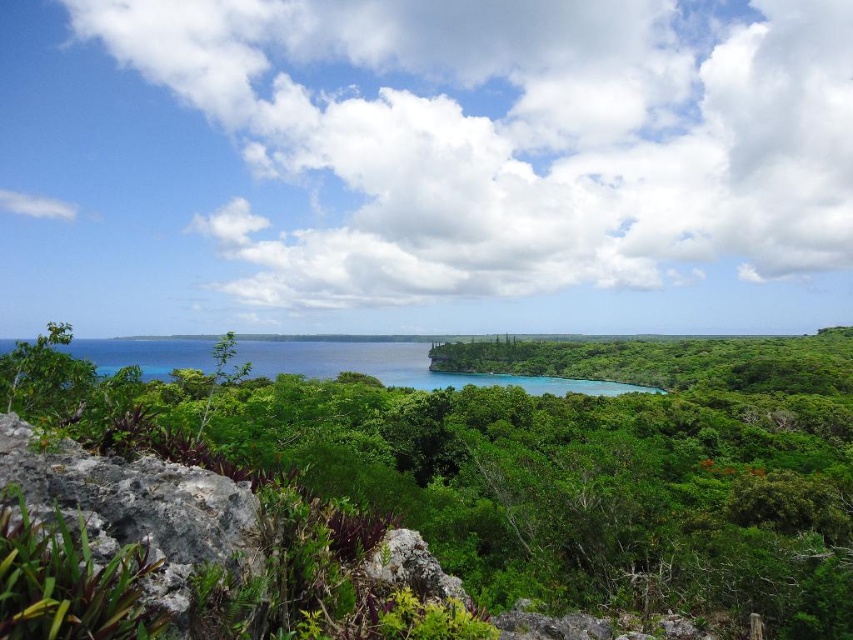
Between point (315, 451) and point (135, 506), which one is positioned in front?

Positioned in front is point (135, 506).

Based on the photo, is green leafy tree at center positioned in front of gray rough rock at lower left?

No, green leafy tree at center is further to the viewer.

Who is more distant from viewer, (703,518) or (198,554)?

Point (703,518)

You are a GUI agent. You are given a task and a screenshot of the screen. Output one action in this format:
    pyautogui.click(x=<x>, y=<y>)
    Task: Click on the green leafy tree at center
    The image size is (853, 640).
    Given the screenshot: What is the action you would take?
    pyautogui.click(x=595, y=470)

Is green leafy tree at center shorter than blue-green water at center?

Yes.

Can you confirm if green leafy tree at center is wider than blue-green water at center?

Yes.

Does point (630, 404) come closer to viewer compared to point (314, 346)?

Yes, point (630, 404) is in front of point (314, 346).

Locate an element on the screen. The width and height of the screenshot is (853, 640). green leafy tree at center is located at coordinates (595, 470).

What do you see at coordinates (137, 508) in the screenshot? This screenshot has height=640, width=853. I see `gray rough rock at lower left` at bounding box center [137, 508].

Find the location of a particular element. This screenshot has width=853, height=640. gray rough rock at lower left is located at coordinates (137, 508).